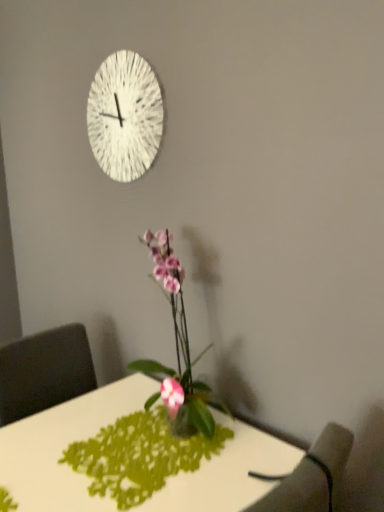
Measure the distance between point (208,395) and camera.

A distance of 4.79 feet exists between point (208,395) and camera.

What do you see at coordinates (125, 116) in the screenshot? Image resolution: width=384 pixels, height=512 pixels. I see `white textured clock at upper center` at bounding box center [125, 116].

The image size is (384, 512). Identify the location of dark gray fabric armchair at lower right. (311, 476).

Are white textured clock at upper center and white glossy desk at center making contact?

There is a gap between white textured clock at upper center and white glossy desk at center.

Is white textured clock at upper center looking in the opposite direction of white glossy desk at center?

No, white textured clock at upper center is not facing the opposite direction of white glossy desk at center.

Is white textured clock at upper center shorter than white glossy desk at center?

Indeed, white textured clock at upper center has a lesser height compared to white glossy desk at center.

From a real-world perspective, between white textured clock at upper center and white glossy desk at center, who is vertically lower?

white glossy desk at center.

Does pink glossy orchid at center have a lesser width compared to dark gray fabric armchair at lower right?

In fact, pink glossy orchid at center might be wider than dark gray fabric armchair at lower right.

Between pink glossy orchid at center and dark gray fabric armchair at lower right, which one has more height?

pink glossy orchid at center is taller.

Do you think pink glossy orchid at center is within dark gray fabric armchair at lower right, or outside of it?

pink glossy orchid at center is spatially situated outside dark gray fabric armchair at lower right.

Is point (197, 428) behind point (336, 474)?

That is True.

Who is bigger, pink glossy orchid at center or white textured clock at upper center?

With larger size is pink glossy orchid at center.

Can you confirm if pink glossy orchid at center is thinner than white textured clock at upper center?

Incorrect, the width of pink glossy orchid at center is not less than that of white textured clock at upper center.

From a real-world perspective, does pink glossy orchid at center stand above white textured clock at upper center?

No.

At what (x,y) coordinates should I click in order to perform the action: click on houseplant lying on the right of white textured clock at upper center. Please return your answer as a coordinate pair (x, y). The height and width of the screenshot is (512, 384). Looking at the image, I should click on (176, 349).

Considering the sizes of objects white glossy desk at center and white textured clock at upper center in the image provided, who is bigger, white glossy desk at center or white textured clock at upper center?

Bigger between the two is white glossy desk at center.

Is white glossy desk at center taller or shorter than white textured clock at upper center?

white glossy desk at center is taller than white textured clock at upper center.

Between white glossy desk at center and white textured clock at upper center, which one is positioned in front?

white glossy desk at center is in front.

From a real-world perspective, is white glossy desk at center over white textured clock at upper center?

No, from a real-world perspective, white glossy desk at center is not over white textured clock at upper center

From the image's perspective, which one is positioned higher, white textured clock at upper center or pink glossy orchid at center?

From the image's view, white textured clock at upper center is above.

Can you confirm if white textured clock at upper center is positioned to the right of pink glossy orchid at center?

In fact, white textured clock at upper center is to the left of pink glossy orchid at center.

From a real-world perspective, is white textured clock at upper center below pink glossy orchid at center?

Incorrect, from a real-world perspective, white textured clock at upper center is higher than pink glossy orchid at center.

Considering the positions of objects white glossy desk at center and pink glossy orchid at center in the image provided, who is more to the left, white glossy desk at center or pink glossy orchid at center?

From the viewer's perspective, white glossy desk at center appears more on the left side.

Considering their positions, is white glossy desk at center located in front of or behind pink glossy orchid at center?

Clearly, white glossy desk at center is in front of pink glossy orchid at center.

Between white glossy desk at center and pink glossy orchid at center, which one has more height?

white glossy desk at center is taller.

From the image's perspective, between dark gray fabric armchair at lower right and white glossy desk at center, who is located below?

white glossy desk at center appears lower in the image.

Which object is wider, dark gray fabric armchair at lower right or white glossy desk at center?

white glossy desk at center is wider.

Is dark gray fabric armchair at lower right oriented away from white glossy desk at center?

dark gray fabric armchair at lower right does not have its back to white glossy desk at center.

Considering the points (328, 447) and (54, 474), which point is behind, point (328, 447) or point (54, 474)?

The point (54, 474) is farther.

At what (x,y) coordinates should I click in order to perform the action: click on wall clock that is above the white glossy desk at center (from the image's perspective). Please return your answer as a coordinate pair (x, y). The width and height of the screenshot is (384, 512). Looking at the image, I should click on (125, 116).

The image size is (384, 512). What are the coordinates of `armchair located in front of the pink glossy orchid at center` in the screenshot? It's located at (311, 476).

Estimate the real-world distances between objects in this image. Which object is further from white textured clock at upper center, dark gray fabric armchair at lower right or pink glossy orchid at center?

dark gray fabric armchair at lower right is further to white textured clock at upper center.

From the image, which object appears to be nearer to white textured clock at upper center, white glossy desk at center or dark gray fabric armchair at lower right?

white glossy desk at center is positioned closer to the anchor white textured clock at upper center.

In the scene shown: When comparing their distances from white glossy desk at center, does white textured clock at upper center or pink glossy orchid at center seem closer?

Among the two, pink glossy orchid at center is located nearer to white glossy desk at center.

Which object lies further to the anchor point white textured clock at upper center, white glossy desk at center or pink glossy orchid at center?

white glossy desk at center is positioned further to the anchor white textured clock at upper center.

In the scene shown: From the image, which object appears to be nearer to white glossy desk at center, white textured clock at upper center or dark gray fabric armchair at lower right?

dark gray fabric armchair at lower right.

Looking at the image, which one is located closer to pink glossy orchid at center, dark gray fabric armchair at lower right or white textured clock at upper center?

Among the two, white textured clock at upper center is located nearer to pink glossy orchid at center.

When comparing their distances from white textured clock at upper center, does dark gray fabric armchair at lower right or white glossy desk at center seem further?

Based on the image, dark gray fabric armchair at lower right appears to be further to white textured clock at upper center.

Estimate the real-world distances between objects in this image. Which object is further from white glossy desk at center, dark gray fabric armchair at lower right or pink glossy orchid at center?

Among the two, dark gray fabric armchair at lower right is located further to white glossy desk at center.

Locate an element on the screen. The height and width of the screenshot is (512, 384). houseplant between white textured clock at upper center and white glossy desk at center from top to bottom is located at coordinates (176, 349).

At what (x,y) coordinates should I click in order to perform the action: click on armchair that lies between pink glossy orchid at center and white glossy desk at center from top to bottom. Please return your answer as a coordinate pair (x, y). The height and width of the screenshot is (512, 384). Looking at the image, I should click on (311, 476).

Locate an element on the screen. armchair between white textured clock at upper center and white glossy desk at center in the up-down direction is located at coordinates (311, 476).

The height and width of the screenshot is (512, 384). Identify the location of houseplant between white textured clock at upper center and dark gray fabric armchair at lower right from top to bottom. (176, 349).